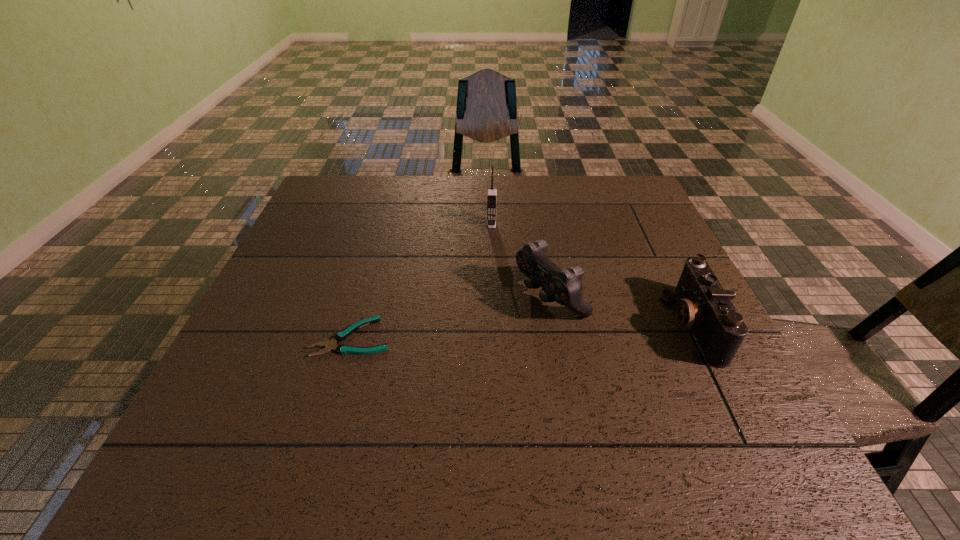
What are the coordinates of `free space between the control and the camera` in the screenshot? It's located at (621, 310).

At what (x,y) coordinates should I click in order to perform the action: click on free spot between the rightmost object and the third object from left to right. Please return your answer as a coordinate pair (x, y). This screenshot has width=960, height=540. Looking at the image, I should click on (621, 310).

Locate an element on the screen. The height and width of the screenshot is (540, 960). vacant region between the camera and the farthest object is located at coordinates pyautogui.click(x=591, y=274).

Find the location of a particular element. This screenshot has width=960, height=540. object that can be found as the closest to the pliers is located at coordinates (564, 286).

Choose which object is the third nearest neighbor to the cellular telephone. Please provide its 2D coordinates. Your answer should be formatted as a tuple, i.e. [(x, y)], where the tuple contains the x and y coordinates of a point satisfying the conditions above.

[(704, 305)]

Identify the location of free space in the image that satisfies the following two spatial constraints: 1. on the back side of the second object from right to left; 2. on the left side of the pliers. (364, 296).

The width and height of the screenshot is (960, 540). Find the location of `free space that satisfies the following two spatial constraints: 1. on the front side of the control; 2. on the right side of the farthest object`. free space that satisfies the following two spatial constraints: 1. on the front side of the control; 2. on the right side of the farthest object is located at coordinates (493, 296).

Locate an element on the screen. This screenshot has height=540, width=960. vacant position in the image that satisfies the following two spatial constraints: 1. on the back side of the shortest object; 2. on the front-facing side of the camera is located at coordinates (355, 325).

Identify the location of vacant space that satisfies the following two spatial constraints: 1. on the back side of the farthest object; 2. on the left side of the pliers. The width and height of the screenshot is (960, 540). (384, 224).

At what (x,y) coordinates should I click in order to perform the action: click on vacant area in the image that satisfies the following two spatial constraints: 1. on the back side of the cellular telephone; 2. on the right side of the pliers. Please return your answer as a coordinate pair (x, y). Looking at the image, I should click on (384, 224).